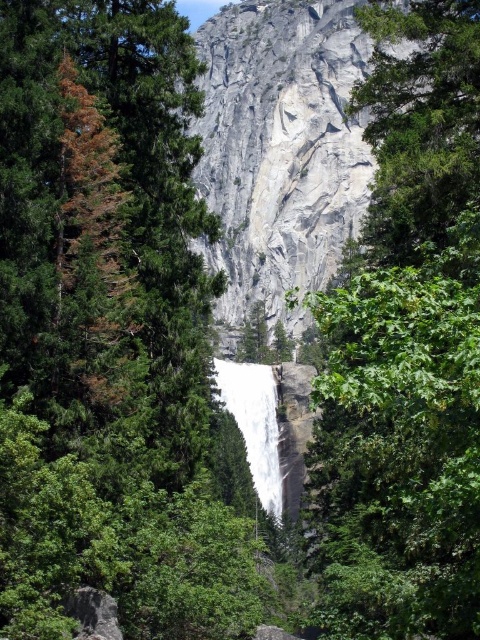
You are standing at the base of Vernal Falls in Yosemite National Park. You notice a green matte tree at center in the scene. Can you provide the exact coordinates of where this tree is located?

The green matte tree at center is located at point (109, 332).

You are a photographer planning to capture the green leafy tree at center and the white smooth waterfall at center in a single shot. Considering their sizes, which object will occupy more space in the photo?

The green leafy tree at center has a larger size compared to the white smooth waterfall at center, so it will occupy more space in the photo.